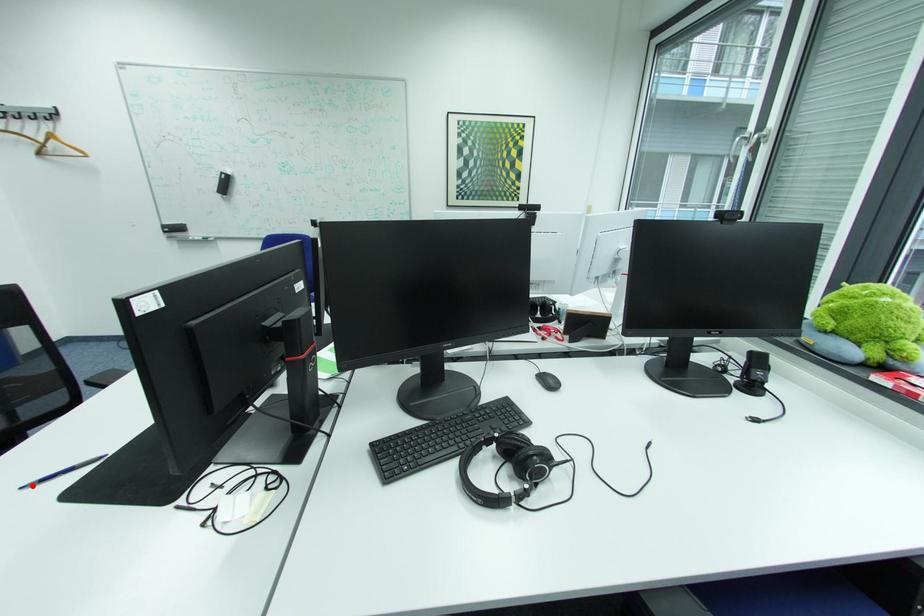
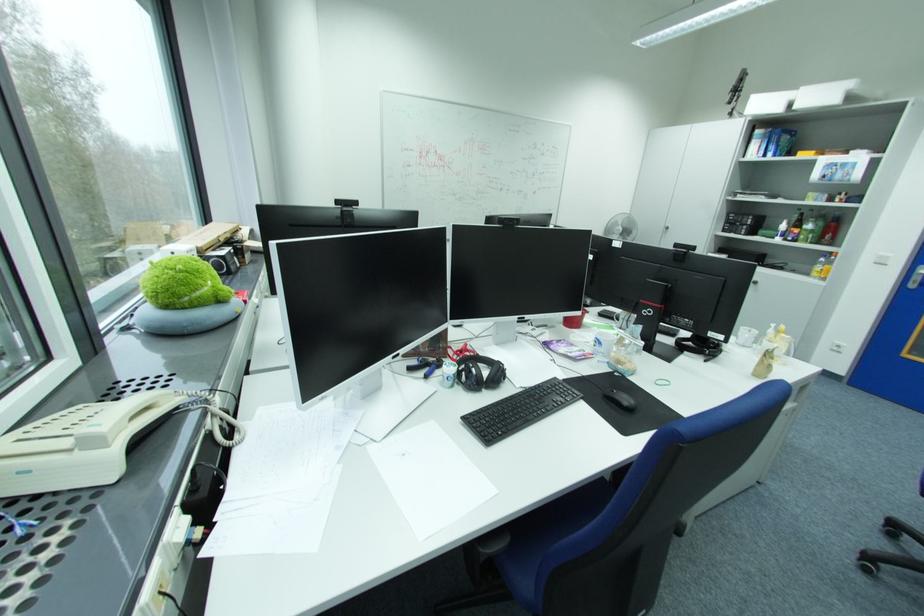
Question: I am providing you with two images of the same scene from different viewpoints. A red point is marked on the first image. Can you still see the location of the red point in image 2?

Choices:
 (A) Yes
 (B) No

Answer: (B)